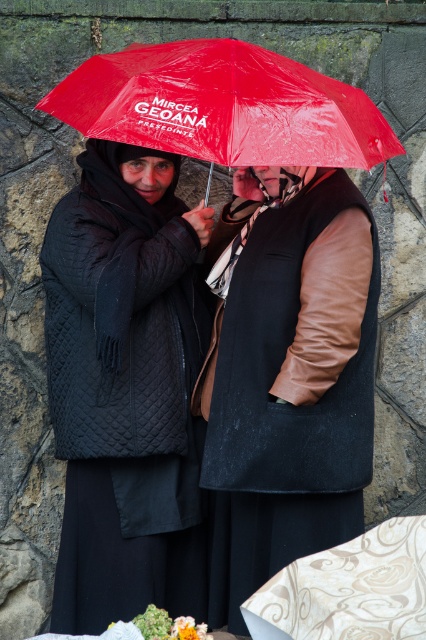
Question: Among these points, which one is farthest from the camera?

Choices:
 (A) (85, 90)
 (B) (103, 557)

Answer: (B)

Question: Is matte black coat at center bigger than red plastic umbrella at upper center?

Choices:
 (A) yes
 (B) no

Answer: (A)

Question: Does matte black coat at center have a greater width compared to red plastic umbrella at upper center?

Choices:
 (A) yes
 (B) no

Answer: (B)

Question: Which point is closer to the camera?

Choices:
 (A) 204,586
 (B) 155,48

Answer: (B)

Question: Is matte black coat at center to the right of red plastic umbrella at upper center from the viewer's perspective?

Choices:
 (A) yes
 (B) no

Answer: (B)